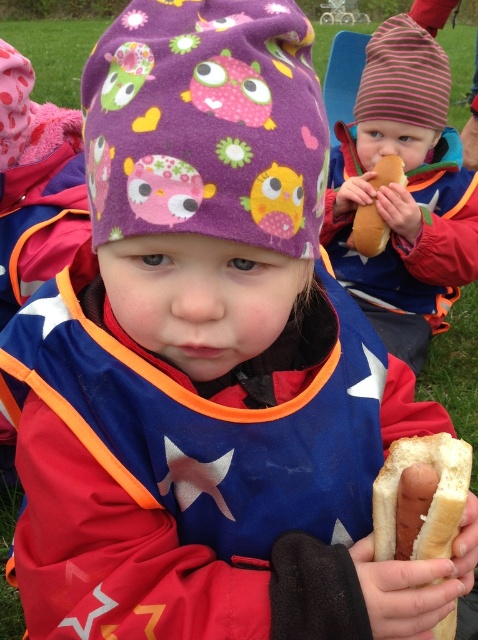
Question: Estimate the real-world distances between objects in this image. Which object is closer to the striped knit hat at upper right?

Choices:
 (A) white soft bread at center
 (B) white soft hot dog at center

Answer: (B)

Question: Considering the relative positions of striped knit hat at upper right and white soft bread at center in the image provided, where is striped knit hat at upper right located with respect to white soft bread at center?

Choices:
 (A) left
 (B) right

Answer: (B)

Question: Which point is farther to the camera?

Choices:
 (A) white soft hot dog at center
 (B) striped knit hat at upper right
 (C) white soft bread at center

Answer: (A)

Question: Does striped knit hat at upper right appear on the right side of white soft bread at center?

Choices:
 (A) no
 (B) yes

Answer: (B)

Question: Which is farther from the striped knit hat at upper right?

Choices:
 (A) white soft bread at center
 (B) white soft hot dog at center

Answer: (A)

Question: Is striped knit hat at upper right to the left of white soft hot dog at center from the viewer's perspective?

Choices:
 (A) no
 (B) yes

Answer: (A)